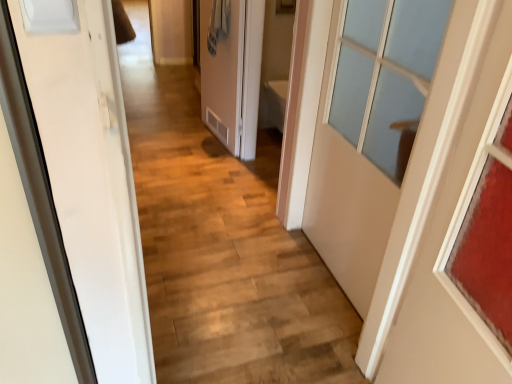
Question: Does white matte door at right, the second door from the left, touch matte white door at center, which appears as the 1th door when viewed from the left?

Choices:
 (A) yes
 (B) no

Answer: (B)

Question: Is white matte door at right, positioned as the second door in back-to-front order, to the left of matte white door at center, which appears as the 1th door when viewed from the left, from the viewer's perspective?

Choices:
 (A) yes
 (B) no

Answer: (B)

Question: Can you confirm if white matte door at right, positioned as the second door in back-to-front order, is shorter than matte white door at center, placed as the third door when sorted from front to back?

Choices:
 (A) no
 (B) yes

Answer: (A)

Question: From the image's perspective, is white matte door at right, which is the second door in front-to-back order, over matte white door at center, the third door from the right?

Choices:
 (A) yes
 (B) no

Answer: (B)

Question: Can you confirm if white matte door at right, positioned as the second door in back-to-front order, is thinner than matte white door at center, placed as the third door when sorted from front to back?

Choices:
 (A) no
 (B) yes

Answer: (A)

Question: Is white matte door at right, the second door from the left, smaller than matte white door at center, which is counted as the first door, starting from the back?

Choices:
 (A) yes
 (B) no

Answer: (B)

Question: Is white matte door at right, positioned as the second door in back-to-front order, to the right of matte glass door at right, which is counted as the 3th door, starting from the back, from the viewer's perspective?

Choices:
 (A) yes
 (B) no

Answer: (B)

Question: Is white matte door at right, positioned as the second door in back-to-front order, oriented towards matte glass door at right, which is the third door in left-to-right order?

Choices:
 (A) no
 (B) yes

Answer: (A)

Question: Is white matte door at right, positioned as the second door in back-to-front order, closer to camera compared to matte glass door at right, which is the third door in left-to-right order?

Choices:
 (A) no
 (B) yes

Answer: (A)

Question: From the image's perspective, is white matte door at right, which is the second door in front-to-back order, on matte glass door at right, the 1th door positioned from the right?

Choices:
 (A) yes
 (B) no

Answer: (A)

Question: Is matte glass door at right, which is counted as the 3th door, starting from the back, a part of white matte door at right, the second door from the left?

Choices:
 (A) yes
 (B) no

Answer: (B)

Question: Considering the relative positions of white matte door at right, positioned as the second door in back-to-front order, and matte glass door at right, which is the third door in left-to-right order, in the image provided, is white matte door at right, positioned as the second door in back-to-front order, behind matte glass door at right, which is the third door in left-to-right order,?

Choices:
 (A) no
 (B) yes

Answer: (B)

Question: Is matte glass door at right, which is counted as the 3th door, starting from the back, to the left of matte white door at center, the third door from the right, from the viewer's perspective?

Choices:
 (A) yes
 (B) no

Answer: (B)